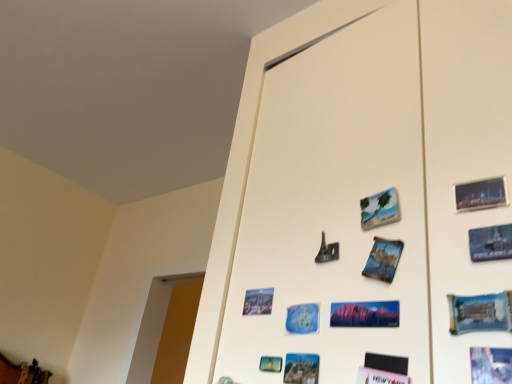
Question: Considering the relative sizes of blue paper postcard at lower center, which appears as the second postcard when viewed from the left, and metallic gold jewelry at lower left in the image provided, is blue paper postcard at lower center, which appears as the second postcard when viewed from the left, shorter than metallic gold jewelry at lower left?

Choices:
 (A) yes
 (B) no

Answer: (A)

Question: Can you see blue paper postcard at lower center, which appears as the second postcard when viewed from the left, touching metallic gold jewelry at lower left?

Choices:
 (A) yes
 (B) no

Answer: (B)

Question: Considering the relative positions of blue paper postcard at lower center, placed as the 7th postcard when sorted from right to left, and metallic gold jewelry at lower left in the image provided, is blue paper postcard at lower center, placed as the 7th postcard when sorted from right to left, to the left of metallic gold jewelry at lower left from the viewer's perspective?

Choices:
 (A) yes
 (B) no

Answer: (B)

Question: Considering the relative positions of blue paper postcard at lower center, which appears as the second postcard when viewed from the left, and metallic gold jewelry at lower left in the image provided, is blue paper postcard at lower center, which appears as the second postcard when viewed from the left, behind metallic gold jewelry at lower left?

Choices:
 (A) yes
 (B) no

Answer: (B)

Question: Would you say matte red rock formation at center, the fourth postcard in the left-to-right sequence, is inside or outside blue paper postcard at lower right, positioned as the first postcard in right-to-left order?

Choices:
 (A) outside
 (B) inside

Answer: (A)

Question: Relative to blue paper postcard at lower right, the 8th postcard from the left, is matte red rock formation at center, the 5th postcard when ordered from right to left, in front or behind?

Choices:
 (A) behind
 (B) front

Answer: (A)

Question: Does point (373, 311) appear closer or farther from the camera than point (471, 357)?

Choices:
 (A) closer
 (B) farther

Answer: (B)

Question: From the image's perspective, is matte red rock formation at center, the 5th postcard when ordered from right to left, positioned above or below blue paper postcard at lower right, the 8th postcard from the left?

Choices:
 (A) below
 (B) above

Answer: (B)

Question: Is blue paper postcard at center, acting as the 4th postcard starting from the right, inside the boundaries of blue glossy postcard at lower right, which ranks as the 7th postcard in left-to-right order, or outside?

Choices:
 (A) outside
 (B) inside

Answer: (A)

Question: Does point (394, 264) appear closer or farther from the camera than point (480, 312)?

Choices:
 (A) farther
 (B) closer

Answer: (A)

Question: Looking at their shapes, would you say blue paper postcard at center, the fifth postcard positioned from the left, is wider or thinner than blue glossy postcard at lower right, which ranks as the 7th postcard in left-to-right order?

Choices:
 (A) wide
 (B) thin

Answer: (A)

Question: Relative to blue glossy postcard at lower right, the second postcard positioned from the right, is blue paper postcard at center, the fifth postcard positioned from the left, in front or behind?

Choices:
 (A) behind
 (B) front

Answer: (A)

Question: Is beige matte postcard at upper center, which is the third postcard in right-to-left order, taller or shorter than matte paper postcard at lower center, arranged as the 1th postcard when viewed from the left?

Choices:
 (A) short
 (B) tall

Answer: (B)

Question: Is beige matte postcard at upper center, arranged as the sixth postcard when viewed from the left, bigger or smaller than matte paper postcard at lower center, arranged as the 1th postcard when viewed from the left?

Choices:
 (A) big
 (B) small

Answer: (A)